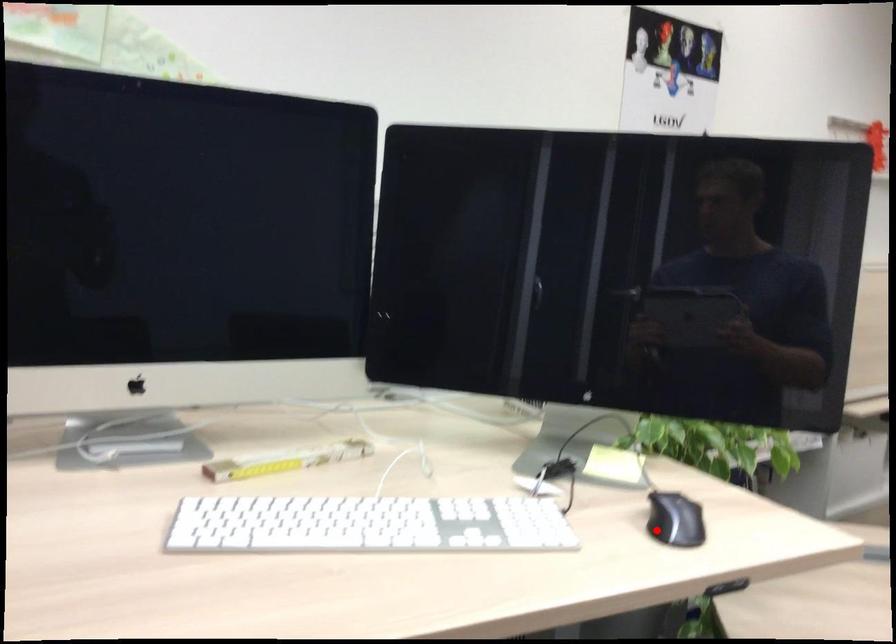
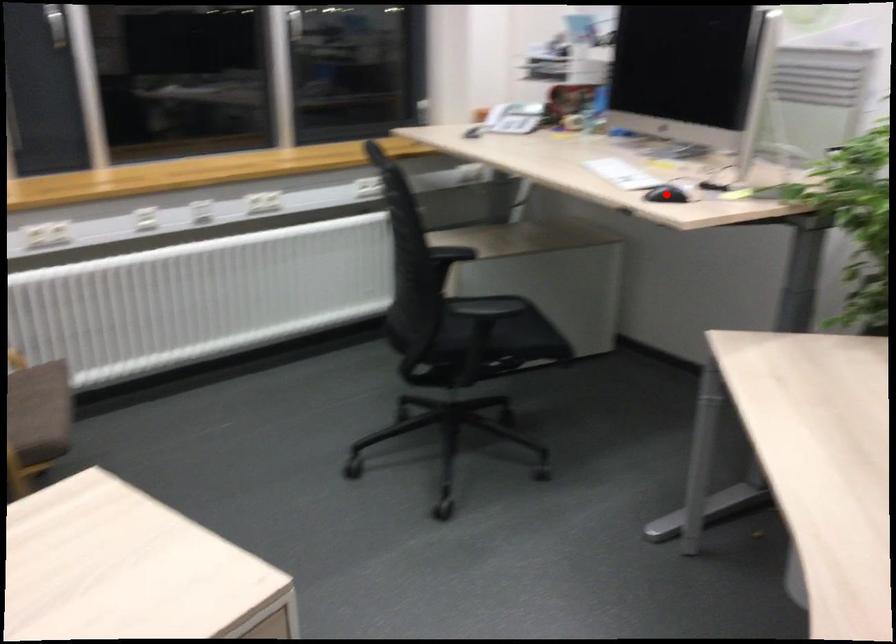
I am providing you with two images of the same scene from different viewpoints. A red point is marked on the first image and another point is marked on the second image. Is the marked point in image1 the same physical position as the marked point in image2?

Yes